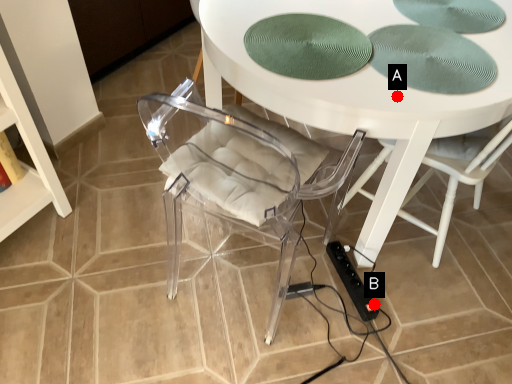
Question: Two points are circled on the image, labeled by A and B beside each circle. Which point is farther from the camera taking this photo?

Choices:
 (A) A is further
 (B) B is further

Answer: (B)